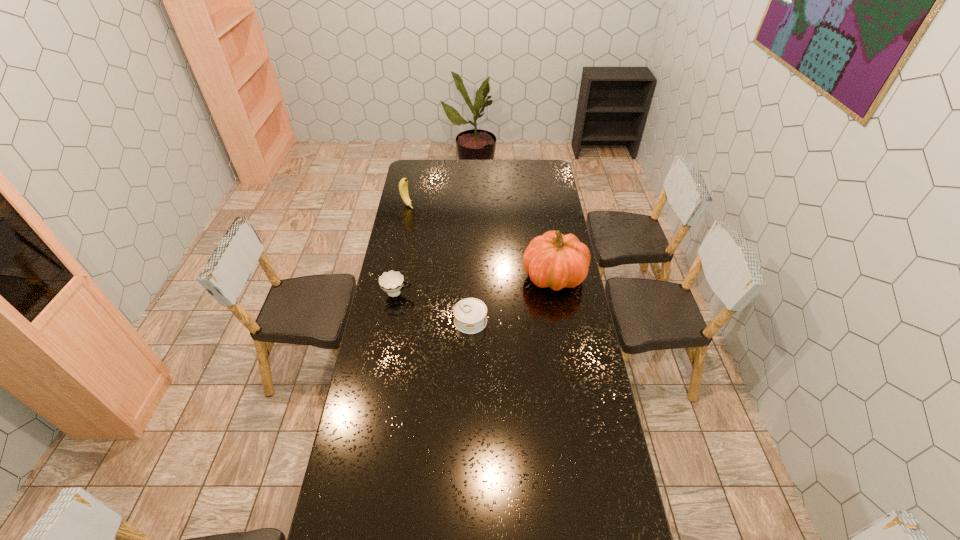
Where is `blank space at the right edge of the desktop`? The height and width of the screenshot is (540, 960). blank space at the right edge of the desktop is located at coordinates (534, 211).

Find the location of a particular element. free space at the far left corner of the desktop is located at coordinates (415, 161).

In the image, there is a desktop. Where is `vacant space at the far right corner`? vacant space at the far right corner is located at coordinates click(x=534, y=176).

Identify the location of unoccupied area between the banana and the tallest object. The image size is (960, 540). (481, 241).

At what (x,y) coordinates should I click in order to perform the action: click on unoccupied position between the rightmost object and the farthest object. Please return your answer as a coordinate pair (x, y). The image size is (960, 540). Looking at the image, I should click on (481, 241).

Locate an element on the screen. The width and height of the screenshot is (960, 540). vacant area between the second tallest object and the shortest object is located at coordinates (440, 264).

Identify the location of vacant area that lies between the second shortest object and the farthest object. The width and height of the screenshot is (960, 540). (402, 249).

Identify the location of free spot between the third tallest object and the third shortest object. The width and height of the screenshot is (960, 540). (402, 249).

Find the location of a particular element. Image resolution: width=960 pixels, height=540 pixels. free space that is in between the can and the cup is located at coordinates (434, 307).

This screenshot has width=960, height=540. Find the location of `free space between the third tallest object and the farthest object`. free space between the third tallest object and the farthest object is located at coordinates (402, 249).